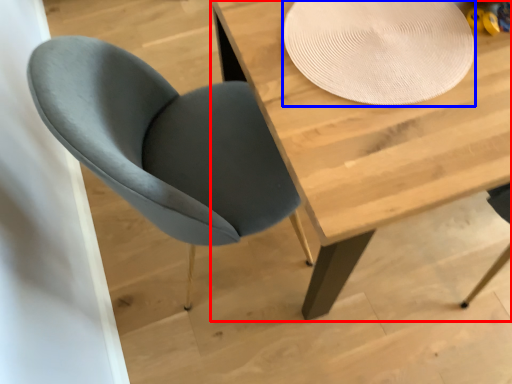
Question: Among these objects, which one is farthest to the camera, table (highlighted by a red box) or paper plate (highlighted by a blue box)?

Choices:
 (A) table
 (B) paper plate

Answer: (B)